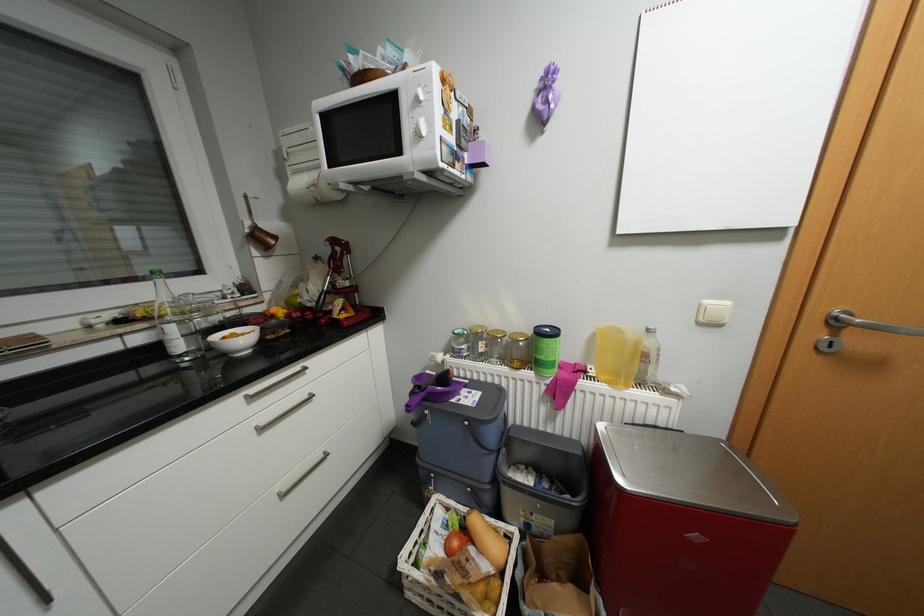
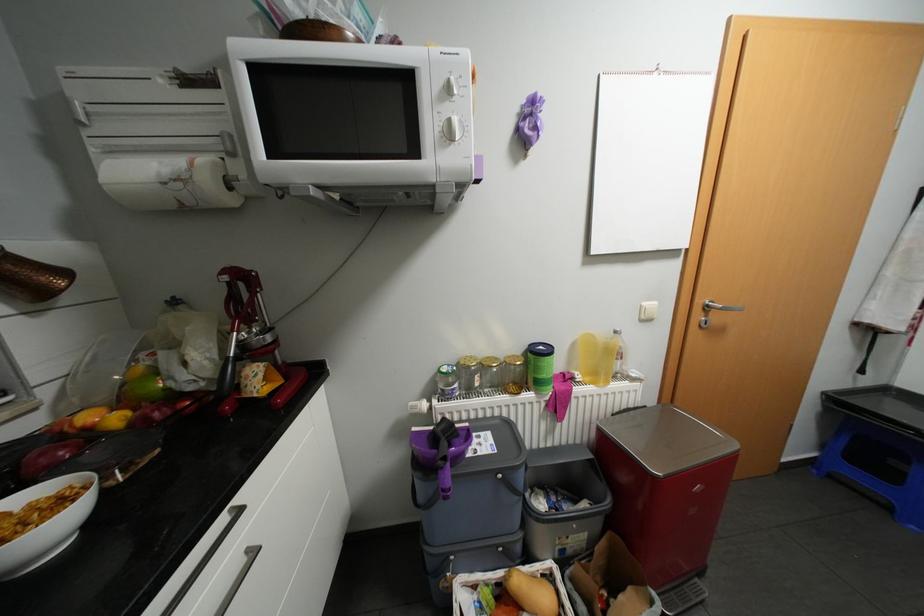
Find the pixel in the second image that matches point 471,345 in the first image.

(464, 384)